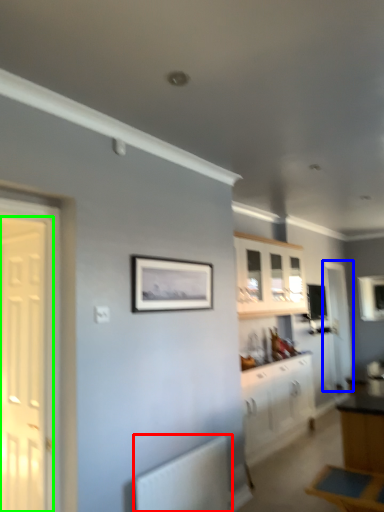
Question: Estimate the real-world distances between objects in this image. Which object is farther from radiator (highlighted by a red box), door (highlighted by a blue box) or door (highlighted by a green box)?

Choices:
 (A) door
 (B) door

Answer: (A)